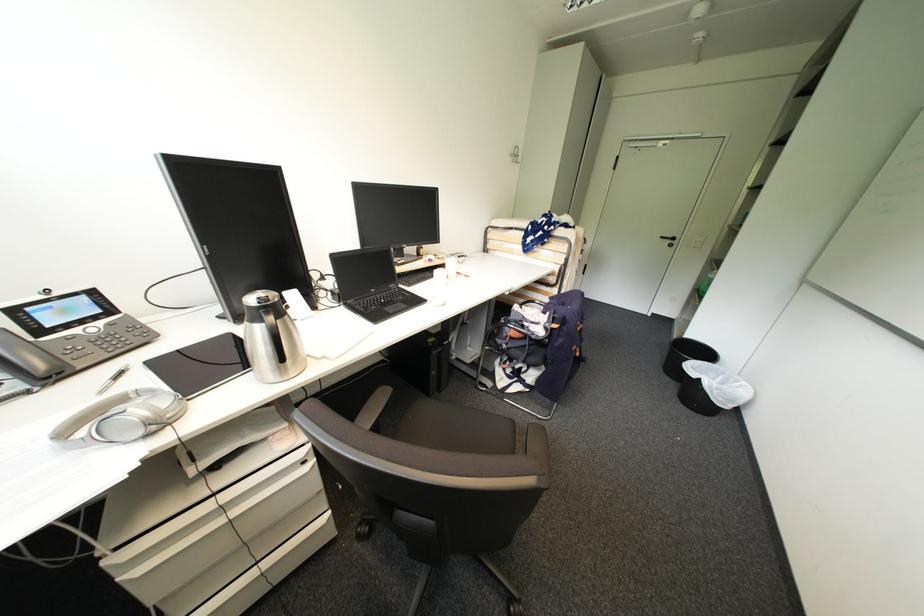
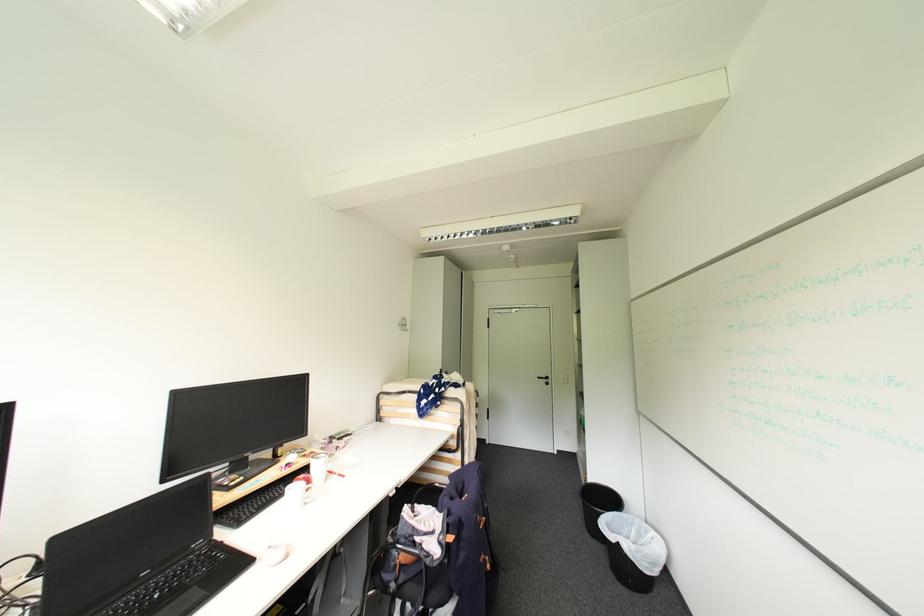
In the second image, find the point that corresponds to pixel 469 277 in the first image.

(343, 477)